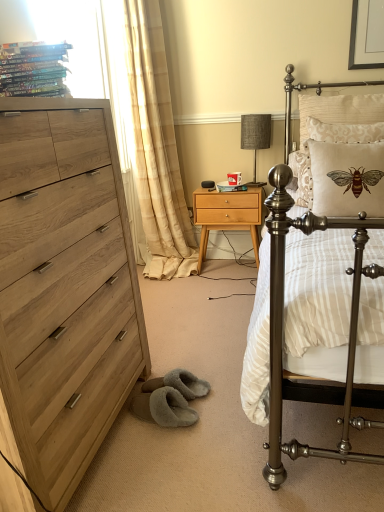
Question: Does beige damask pillow at upper right, placed as the 2th pillow when sorted from back to front, have a lesser width compared to metallic bed at right?

Choices:
 (A) yes
 (B) no

Answer: (A)

Question: Is beige damask pillow at upper right, placed as the 2th pillow when sorted from back to front, facing towards metallic bed at right?

Choices:
 (A) yes
 (B) no

Answer: (A)

Question: Can you confirm if beige damask pillow at upper right, marked as the second pillow in a front-to-back arrangement, is positioned to the left of metallic bed at right?

Choices:
 (A) yes
 (B) no

Answer: (B)

Question: From the image's perspective, is beige damask pillow at upper right, marked as the second pillow in a front-to-back arrangement, on metallic bed at right?

Choices:
 (A) no
 (B) yes

Answer: (B)

Question: Is beige damask pillow at upper right, marked as the second pillow in a front-to-back arrangement, facing away from metallic bed at right?

Choices:
 (A) yes
 (B) no

Answer: (A)

Question: Can you confirm if beige textured pillow with bee design at upper right, positioned as the 3th pillow in front-to-back order, is positioned to the left of beige fabric pillow with embroidered bee at upper right, the third pillow in the back-to-front sequence?

Choices:
 (A) yes
 (B) no

Answer: (B)

Question: Does beige textured pillow with bee design at upper right, positioned as the 3th pillow in front-to-back order, have a greater height compared to beige fabric pillow with embroidered bee at upper right, the first pillow from the front?

Choices:
 (A) no
 (B) yes

Answer: (B)

Question: From the image's perspective, does beige textured pillow with bee design at upper right, the 1th pillow when ordered from back to front, appear higher than beige fabric pillow with embroidered bee at upper right, the first pillow from the front?

Choices:
 (A) yes
 (B) no

Answer: (A)

Question: Is beige textured pillow with bee design at upper right, positioned as the 3th pillow in front-to-back order, smaller than beige fabric pillow with embroidered bee at upper right, the third pillow in the back-to-front sequence?

Choices:
 (A) yes
 (B) no

Answer: (B)

Question: Is beige textured pillow with bee design at upper right, the 1th pillow when ordered from back to front, in contact with beige fabric pillow with embroidered bee at upper right, the first pillow from the front?

Choices:
 (A) yes
 (B) no

Answer: (B)

Question: Can you confirm if beige textured pillow with bee design at upper right, the 1th pillow when ordered from back to front, is thinner than beige fabric pillow with embroidered bee at upper right, the third pillow in the back-to-front sequence?

Choices:
 (A) yes
 (B) no

Answer: (B)

Question: Considering the relative positions of textured fabric lampshade at upper center and matte white magazine at center, which is the 1th magazine in right-to-left order, in the image provided, is textured fabric lampshade at upper center to the right of matte white magazine at center, which is the 1th magazine in right-to-left order, from the viewer's perspective?

Choices:
 (A) yes
 (B) no

Answer: (A)